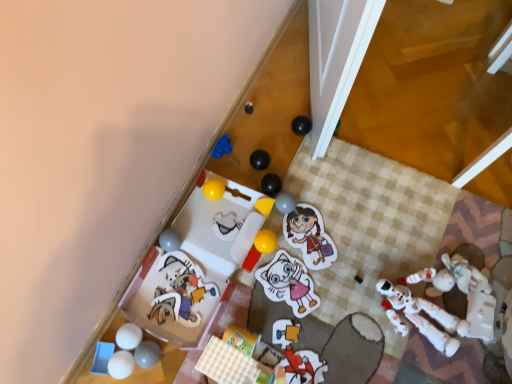
Where is `vacant space in between yellow matte block at upper center, placed as the 11th toy when sorted from left to right, and white plastic toy at lower right, the fifteenth toy viewed from the left`? The width and height of the screenshot is (512, 384). vacant space in between yellow matte block at upper center, placed as the 11th toy when sorted from left to right, and white plastic toy at lower right, the fifteenth toy viewed from the left is located at coordinates (332, 251).